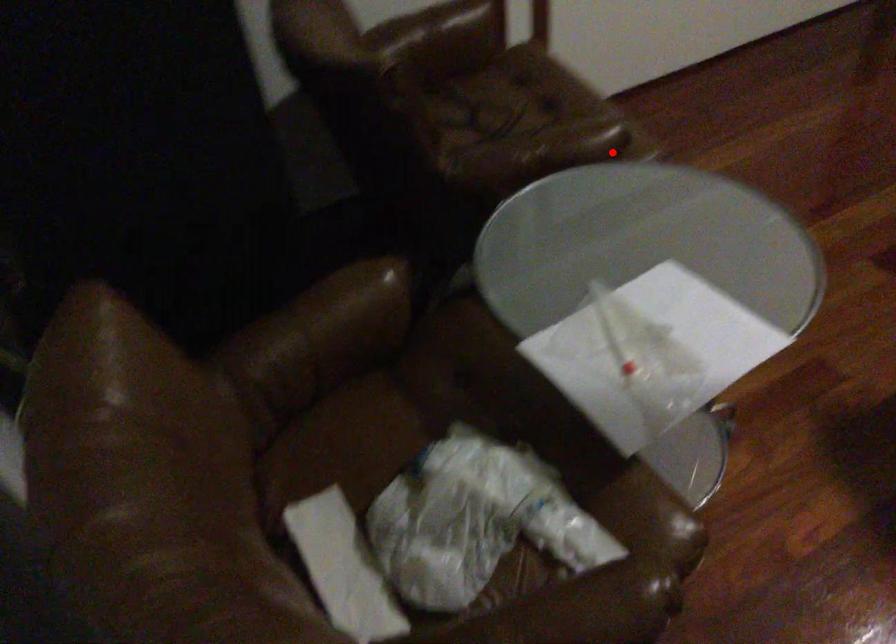
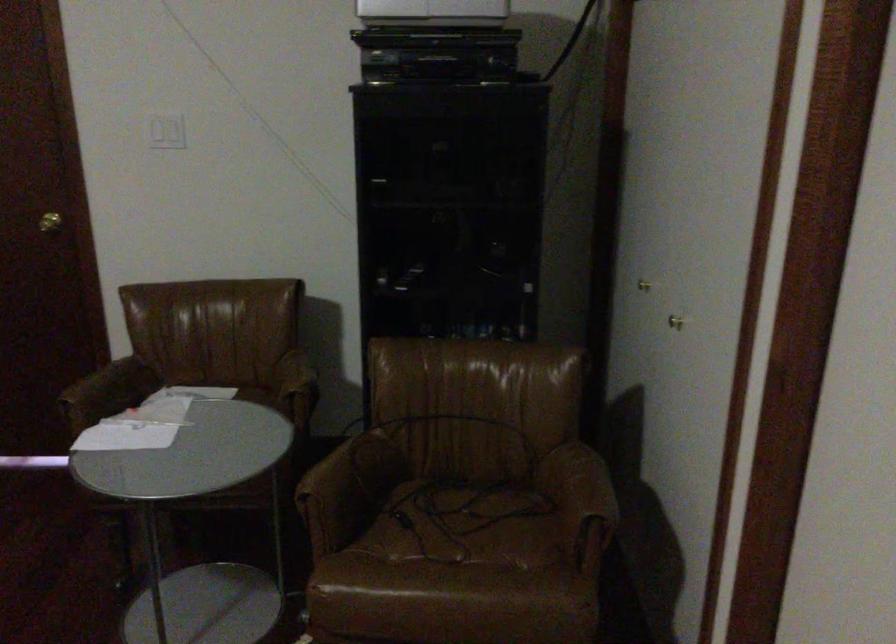
Find the pixel in the second image that matches the highlighted location in the first image.

(312, 513)